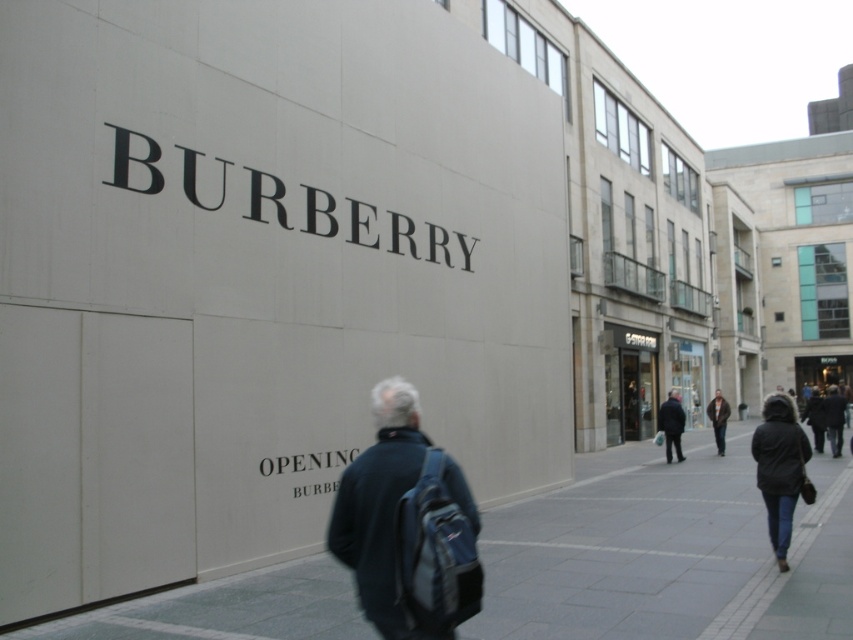
You are standing at the entrance of the Burberry store and want to walk to the GStar Raw store. Which direction should you walk relative to the gray concrete pavement at lower center?

To reach the GStar Raw store, you should walk to the right of the gray concrete pavement at lower center since the GStar Raw store is located to the right of the Burberry wall.

You are standing at point (407, 525) in the street scene. What object is located at this point?

The dark blue backpack at center is located at point (407, 525).

You are standing on the gray concrete pavement at lower center and want to place the dark brown leather jacket at center on the pavement. Can the jacket fit entirely on the pavement without hanging off the edges?

The gray concrete pavement at lower center might be wider than dark brown leather jacket at center, so there is a possibility that the jacket can fit entirely on the pavement without hanging off the edges, but the exact dimensions are uncertain.